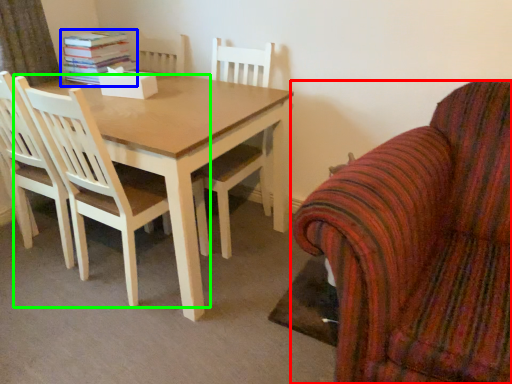
Question: Considering the real-world distances, which object is closest to chair (highlighted by a red box)? book (highlighted by a blue box) or chair (highlighted by a green box).

Choices:
 (A) book
 (B) chair

Answer: (B)